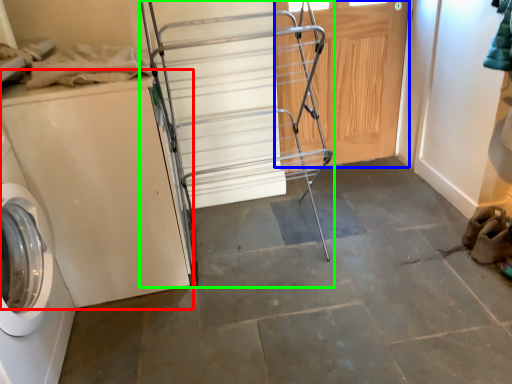
Question: Which is nearer to the washing machine (highlighted by a red box)? door (highlighted by a blue box) or cart (highlighted by a green box).

Choices:
 (A) door
 (B) cart

Answer: (B)